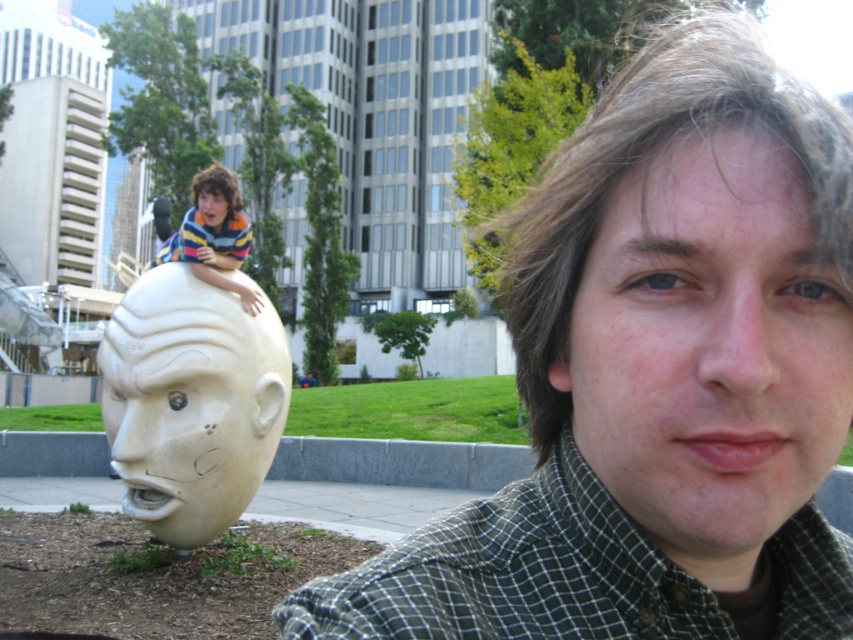
You are a photographer trying to capture both the matte white head at left and the matte yellow head at left in a single frame. Based on their sizes, which one should you focus on to ensure both fit in the photo?

Since the matte white head at left is wider than the matte yellow head at left, you should focus on the matte white head at left to ensure both fit in the photo.

You are a photographer trying to capture a photo of both the green checkered shirt at lower right and the matte yellow head at left in the same frame. Based on their positions, can you confirm if they are positioned side by side horizontally?

The green checkered shirt at lower right is to the right of matte yellow head at left, so they are positioned side by side horizontally from left to right.